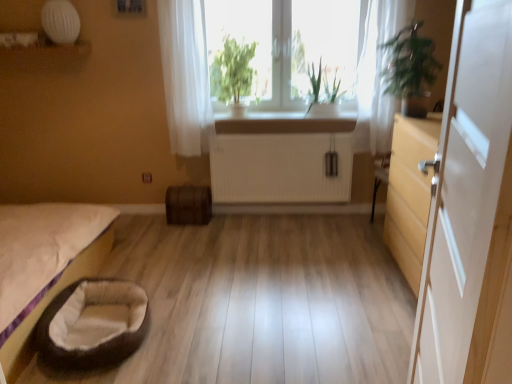
Question: Considering the relative sizes of white sheer curtain at upper center, placed as the 2th curtain when sorted from right to left, and green leafy plant at right in the image provided, is white sheer curtain at upper center, placed as the 2th curtain when sorted from right to left, smaller than green leafy plant at right?

Choices:
 (A) no
 (B) yes

Answer: (B)

Question: Does white sheer curtain at upper center, placed as the 2th curtain when sorted from right to left, lie in front of green leafy plant at right?

Choices:
 (A) yes
 (B) no

Answer: (B)

Question: Considering the relative sizes of white sheer curtain at upper center, the first curtain from the left, and green leafy plant at right in the image provided, is white sheer curtain at upper center, the first curtain from the left, shorter than green leafy plant at right?

Choices:
 (A) no
 (B) yes

Answer: (A)

Question: Is white sheer curtain at upper center, placed as the 2th curtain when sorted from right to left, next to green leafy plant at right and touching it?

Choices:
 (A) no
 (B) yes

Answer: (A)

Question: Could you tell me if white sheer curtain at upper center, the first curtain from the left, is turned towards green leafy plant at right?

Choices:
 (A) no
 (B) yes

Answer: (A)

Question: From the image's perspective, is white sheer curtain at upper right, which is the second curtain from left to right, above or below white glossy door at right?

Choices:
 (A) above
 (B) below

Answer: (A)

Question: Is white sheer curtain at upper right, which is the 1th curtain from right to left, inside or outside of white glossy door at right?

Choices:
 (A) inside
 (B) outside

Answer: (B)

Question: Considering the positions of white sheer curtain at upper right, which is the 1th curtain from right to left, and white glossy door at right in the image, is white sheer curtain at upper right, which is the 1th curtain from right to left, bigger or smaller than white glossy door at right?

Choices:
 (A) small
 (B) big

Answer: (A)

Question: Is point (380, 102) closer or farther from the camera than point (430, 294)?

Choices:
 (A) closer
 (B) farther

Answer: (B)

Question: From a real-world perspective, is white ribbed radiator at center physically located above or below beige fabric pet bed at lower left?

Choices:
 (A) below
 (B) above

Answer: (B)

Question: Relative to beige fabric pet bed at lower left, is white ribbed radiator at center in front or behind?

Choices:
 (A) front
 (B) behind

Answer: (B)

Question: Looking at their shapes, would you say white ribbed radiator at center is wider or thinner than beige fabric pet bed at lower left?

Choices:
 (A) thin
 (B) wide

Answer: (A)

Question: Is white ribbed radiator at center situated inside beige fabric pet bed at lower left or outside?

Choices:
 (A) inside
 (B) outside

Answer: (B)

Question: From a real-world perspective, is white ribbed radiator at center above or below green leafy plant at center, placed as the 2th plant when sorted from right to left?

Choices:
 (A) above
 (B) below

Answer: (B)

Question: Considering the positions of white ribbed radiator at center and green leafy plant at center, placed as the 2th plant when sorted from right to left, in the image, is white ribbed radiator at center wider or thinner than green leafy plant at center, placed as the 2th plant when sorted from right to left,?

Choices:
 (A) wide
 (B) thin

Answer: (B)